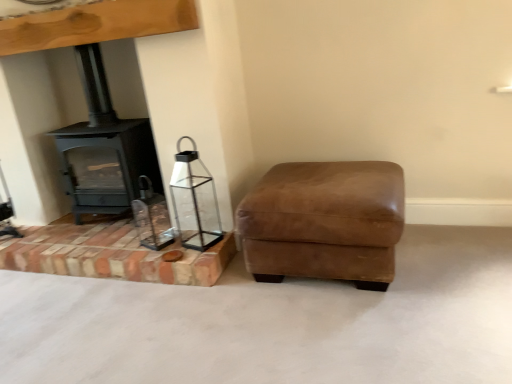
At what (x,y) coordinates should I click in order to perform the action: click on blank space to the left of clear glass lantern at lower left. Please return your answer as a coordinate pair (x, y). Looking at the image, I should click on (160, 250).